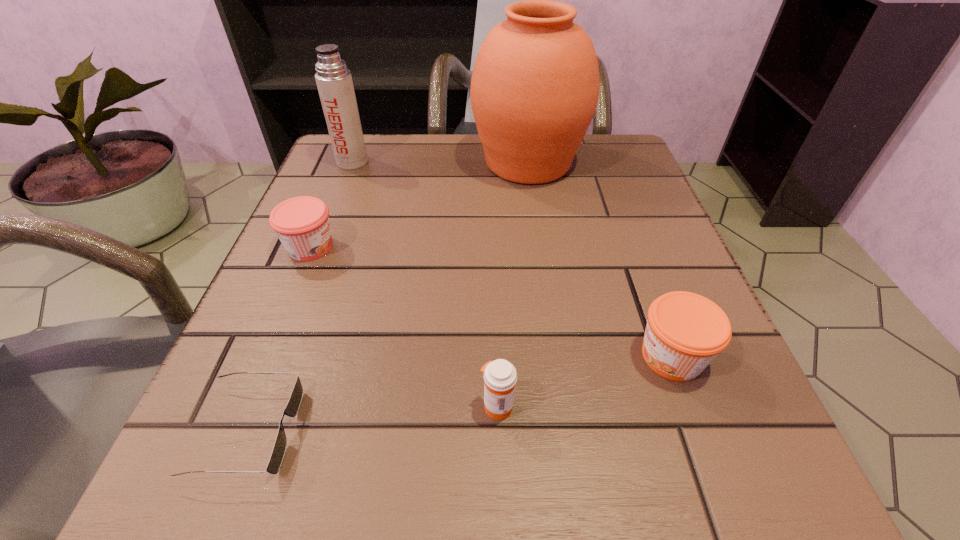
Find the location of a particular element. The image size is (960, 540). sunglasses located at the left edge is located at coordinates (292, 408).

Find the location of a particular element. The width and height of the screenshot is (960, 540). urn at the right edge is located at coordinates (535, 85).

Identify the location of jam positioned at the right edge. (685, 331).

You are a GUI agent. You are given a task and a screenshot of the screen. Output one action in this format:
    pyautogui.click(x=<x>, y=<y>)
    Task: Click on the object that is at the far left corner
    
    Given the screenshot: What is the action you would take?
    pyautogui.click(x=334, y=81)

Image resolution: width=960 pixels, height=540 pixels. In order to click on object at the near left corner in this screenshot , I will do `click(292, 408)`.

In order to click on object located at the far right corner in this screenshot , I will do `click(535, 85)`.

In the image, there is a desktop. Where is `vacant space at the left edge`? vacant space at the left edge is located at coordinates (303, 274).

Locate an element on the screen. free space at the right edge is located at coordinates (608, 300).

The height and width of the screenshot is (540, 960). In the image, there is a desktop. What are the coordinates of `vacant space at the far left corner` in the screenshot? It's located at (311, 184).

Find the location of a particular element. This screenshot has width=960, height=540. vacant space at the far right corner of the desktop is located at coordinates (606, 147).